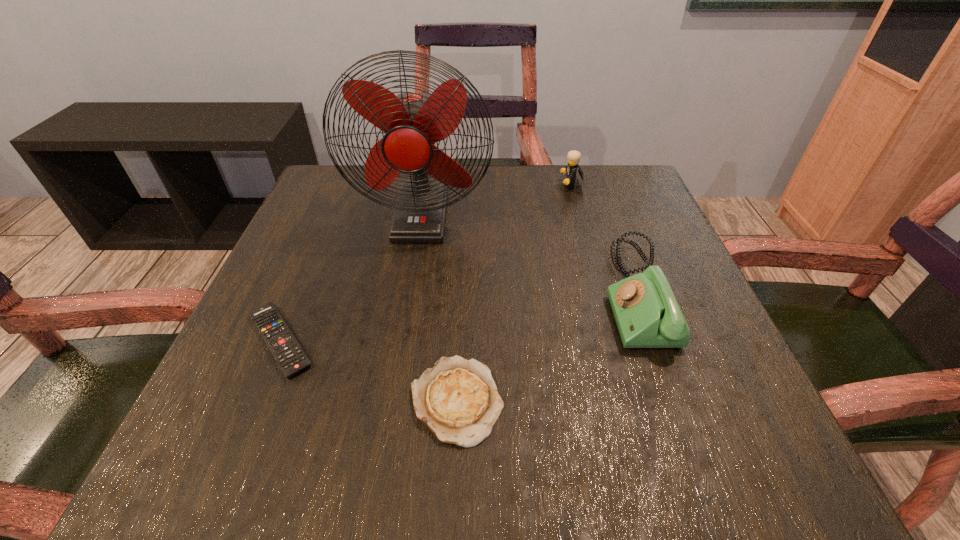
The image size is (960, 540). I want to click on telephone present at the right edge, so click(647, 314).

I want to click on object present at the far left corner, so click(413, 122).

What are the coordinates of `object located in the far right corner section of the desktop` in the screenshot? It's located at (574, 156).

In the image, there is a desktop. Find the location of `vacant space at the far edge`. vacant space at the far edge is located at coordinates (393, 188).

Identify the location of free space at the near edge of the desktop. (634, 480).

This screenshot has width=960, height=540. I want to click on free space at the left edge, so click(x=252, y=366).

In the image, there is a desktop. Find the location of `vacant space at the right edge`. vacant space at the right edge is located at coordinates (627, 275).

Find the location of a particular element. free region at the far left corner of the desktop is located at coordinates click(310, 201).

Where is `vacant space at the near left corner of the desktop`? The height and width of the screenshot is (540, 960). vacant space at the near left corner of the desktop is located at coordinates (181, 440).

The width and height of the screenshot is (960, 540). In order to click on free space at the far right corner of the desktop in this screenshot , I will do `click(652, 201)`.